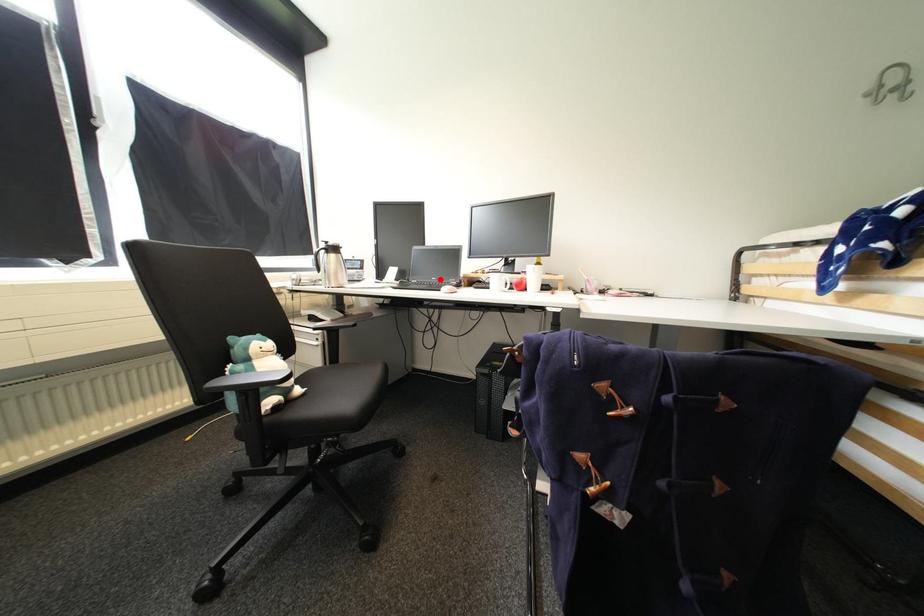
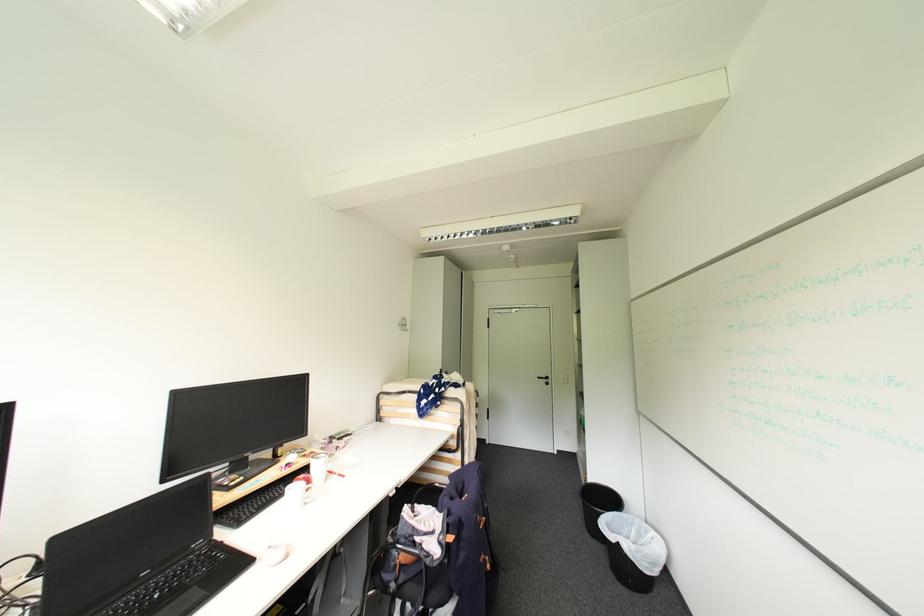
Locate, in the second image, the point that corresponds to the highlighted location in the first image.

(150, 575)